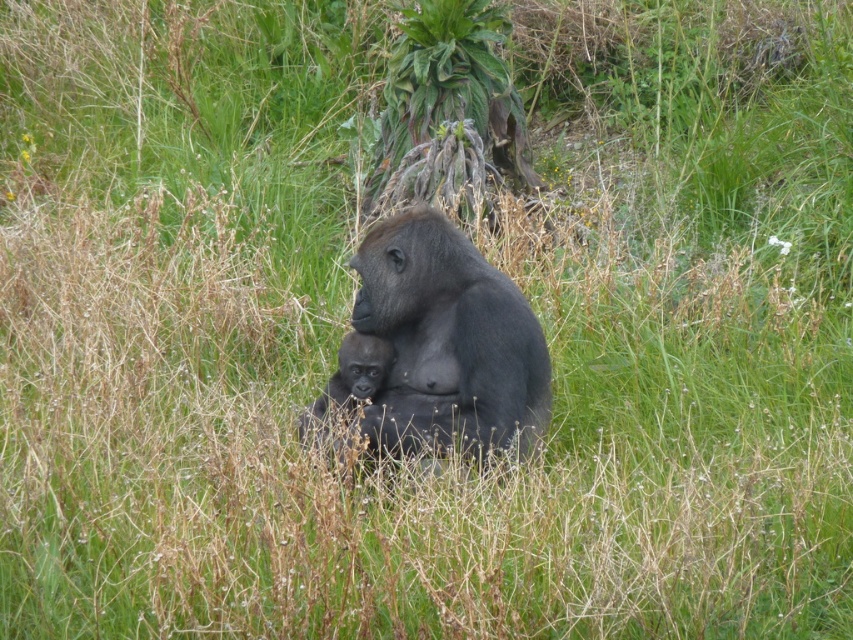
Question: Which point is closer to the camera taking this photo?

Choices:
 (A) (366, 356)
 (B) (384, 445)

Answer: (B)

Question: From the image, what is the correct spatial relationship of shiny dark gray gorilla at center in relation to smooth dark gray baby gorilla at center?

Choices:
 (A) right
 (B) left

Answer: (A)

Question: Is the position of shiny dark gray gorilla at center less distant than that of smooth dark gray baby gorilla at center?

Choices:
 (A) yes
 (B) no

Answer: (B)

Question: Among these points, which one is farthest from the camera?

Choices:
 (A) (341, 353)
 (B) (410, 404)

Answer: (A)

Question: Is shiny dark gray gorilla at center positioned before smooth dark gray baby gorilla at center?

Choices:
 (A) yes
 (B) no

Answer: (B)